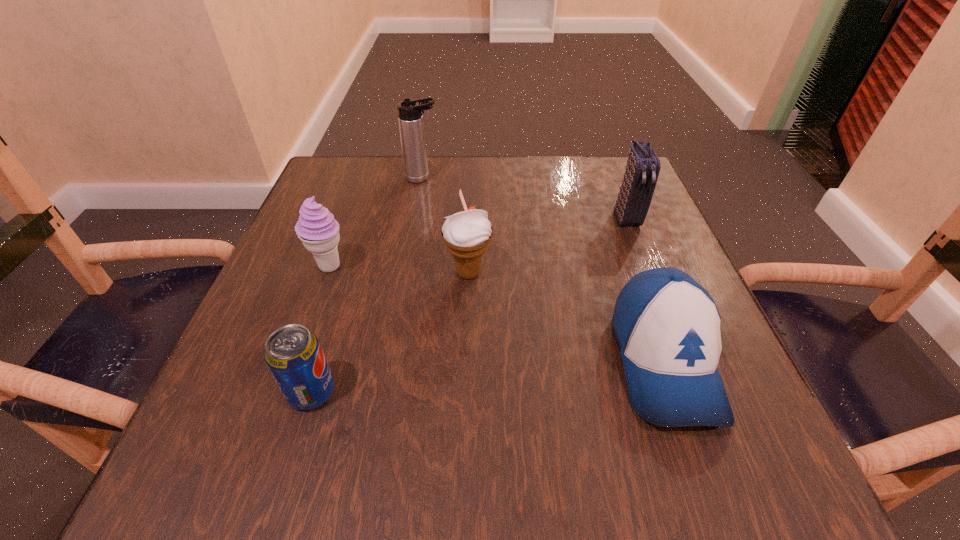
Identify the location of thermos bottle. (410, 117).

In order to click on the third object from left to right in this screenshot , I will do `click(410, 117)`.

You are a GUI agent. You are given a task and a screenshot of the screen. Output one action in this format:
    pyautogui.click(x=<x>, y=<y>)
    Task: Click on the clutch bag
    
    Given the screenshot: What is the action you would take?
    pyautogui.click(x=643, y=166)

You are a GUI agent. You are given a task and a screenshot of the screen. Output one action in this format:
    pyautogui.click(x=<x>, y=<y>)
    Task: Click on the fourth object from left to right
    The height and width of the screenshot is (540, 960).
    Given the screenshot: What is the action you would take?
    pyautogui.click(x=467, y=235)

Locate an element on the screen. Image resolution: width=960 pixels, height=540 pixels. the left icecream is located at coordinates pos(317,229).

This screenshot has height=540, width=960. Find the location of `baseball cap`. baseball cap is located at coordinates (667, 326).

Image resolution: width=960 pixels, height=540 pixels. In order to click on soda in this screenshot , I will do `click(293, 354)`.

Locate an element on the screen. The height and width of the screenshot is (540, 960). blank space located 0.190m on the handle side of the farthest object is located at coordinates (518, 178).

In order to click on blank space located 0.170m with the zip open on the clutch bag in this screenshot , I will do `click(656, 292)`.

Identify the location of vacant space positioned 0.350m on the right of the third object from right to left. (679, 273).